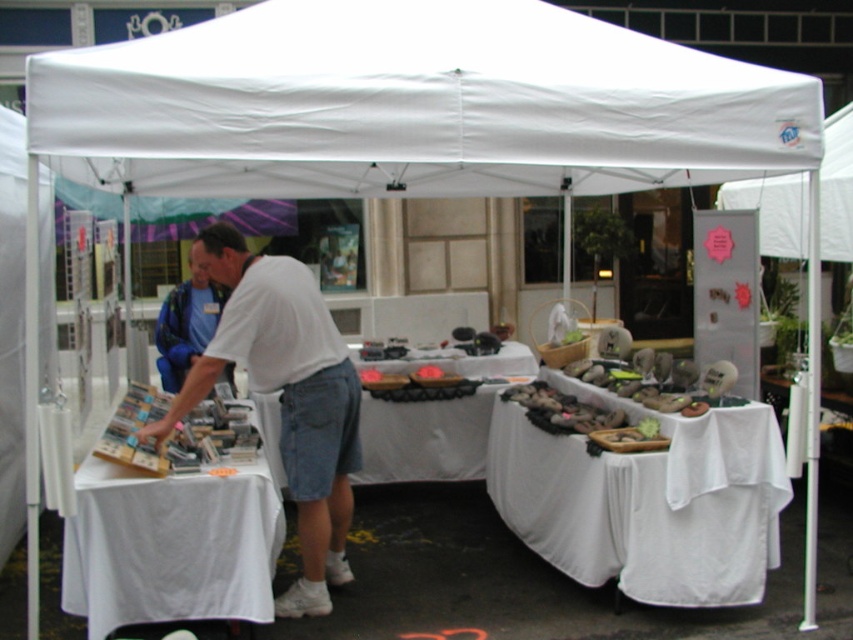
Question: Which object appears farthest from the camera in this image?

Choices:
 (A) white fabric table at center
 (B) blue fabric shirt at center
 (C) white cloth-covered table at center
 (D) white fabric canopy at upper center

Answer: (A)

Question: Which point is farther to the camera?

Choices:
 (A) (410, 403)
 (B) (331, 499)

Answer: (A)

Question: Is white cloth-covered table at center below white paper table at left?

Choices:
 (A) yes
 (B) no

Answer: (B)

Question: Is white cloth-covered table at center closer to the viewer compared to blue fabric shirt at center?

Choices:
 (A) no
 (B) yes

Answer: (B)

Question: Which object is farther from the camera taking this photo?

Choices:
 (A) white paper table at left
 (B) white cotton shirt at center

Answer: (B)

Question: Observing the image, what is the correct spatial positioning of white paper table at left in reference to white fabric table at center?

Choices:
 (A) above
 (B) below

Answer: (B)